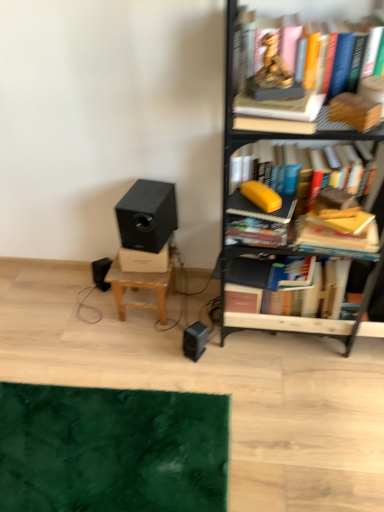
Locate an element on the screen. The height and width of the screenshot is (512, 384). vacant area that lies between metallic black bookcase at right and wooden stool at lower center is located at coordinates (x=196, y=309).